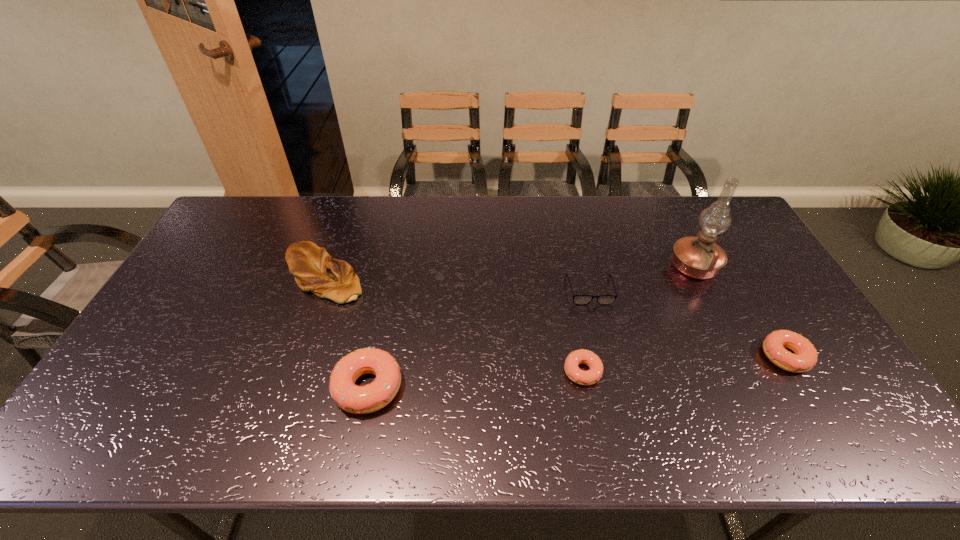
In order to click on vacant area situated 0.120m on the back of the bread in this screenshot , I will do `click(341, 227)`.

Where is `free location located 0.250m on the front of the tallest object`? This screenshot has height=540, width=960. free location located 0.250m on the front of the tallest object is located at coordinates (736, 352).

Where is `vacant point located 0.090m on the front-facing side of the spectacles`? The image size is (960, 540). vacant point located 0.090m on the front-facing side of the spectacles is located at coordinates (600, 330).

Locate an element on the screen. object that is at the right edge is located at coordinates (805, 357).

Identify the location of object that is at the near right corner. (805, 357).

Identify the location of free region at the far edge of the desktop. (348, 223).

What are the coordinates of `blank space at the near edge of the desktop` in the screenshot? It's located at (756, 390).

Locate an element on the screen. Image resolution: width=960 pixels, height=540 pixels. vacant space at the right edge is located at coordinates (770, 273).

Identify the location of free space at the far left corner of the desktop. (219, 236).

The image size is (960, 540). Find the location of `free point between the shortest doughnut and the third shortest object`. free point between the shortest doughnut and the third shortest object is located at coordinates (684, 364).